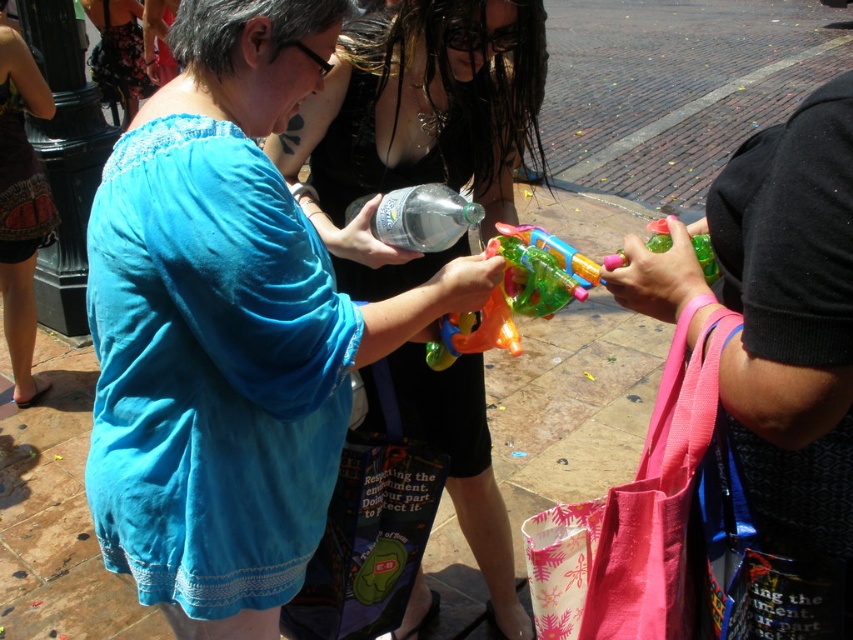
Question: From the image, what is the correct spatial relationship of matte blue shirt at center in relation to translucent plastic water gun at center?

Choices:
 (A) below
 (B) above

Answer: (A)

Question: Which point appears closest to the camera in this image?

Choices:
 (A) (550, 310)
 (B) (741, 211)
 (C) (366, 170)

Answer: (B)

Question: Is pink fabric bag at right to the right of translucent plastic water gun at center from the viewer's perspective?

Choices:
 (A) yes
 (B) no

Answer: (A)

Question: Which object is the farthest from the pink fabric bag at right?

Choices:
 (A) translucent plastic water gun at center
 (B) matte blue shirt at center

Answer: (B)

Question: Where is matte blue shirt at center located in relation to translucent plastic water gun at center in the image?

Choices:
 (A) below
 (B) above

Answer: (A)

Question: Which object is positioned closest to the matte blue shirt at center?

Choices:
 (A) translucent plastic water gun at center
 (B) pink fabric bag at right

Answer: (A)